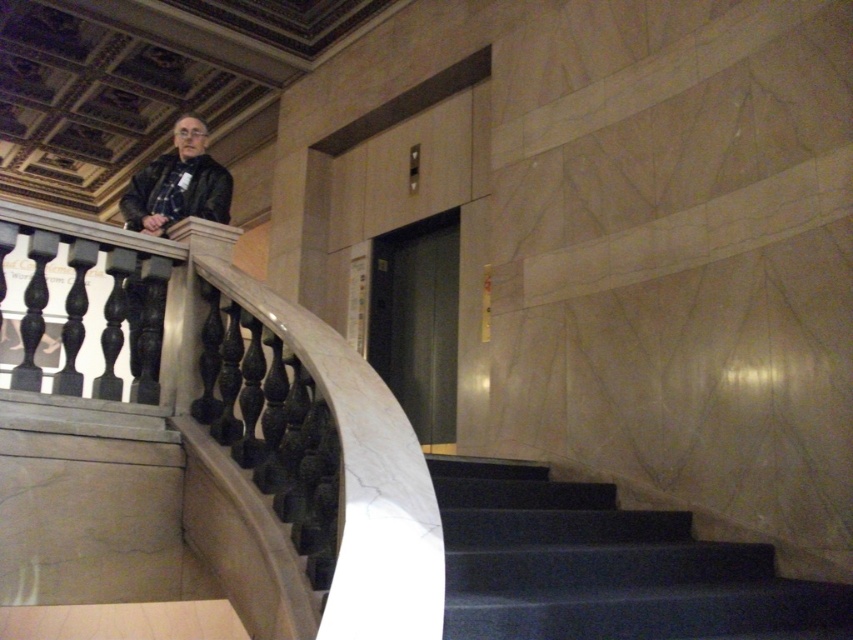
From the picture: You are standing at the bottom of the grand staircase and want to know where the white marble railing at upper left is positioned relative to the staircase. Can you determine its location based on the coordinates provided?

The white marble railing at upper left is located at coordinates point (207, 454), which places it in the upper left area of the image near the top of the staircase.

You are an interior designer observing the staircase scene. You notice two objects labeled as matte black jacket at upper left and matte black jacket at left. Which one is closer to the bottom of the staircase?

The matte black jacket at upper left is positioned under the matte black jacket at left, so the matte black jacket at upper left is closer to the bottom of the staircase.

You are standing at the bottom of the grand staircase and want to hand a note to the person at the top. Which object is closer to you, the white marble railing at upper left or the matte black jacket at left?

The white marble railing at upper left is closer to the viewer than the matte black jacket at left, so the railing is closer to you.